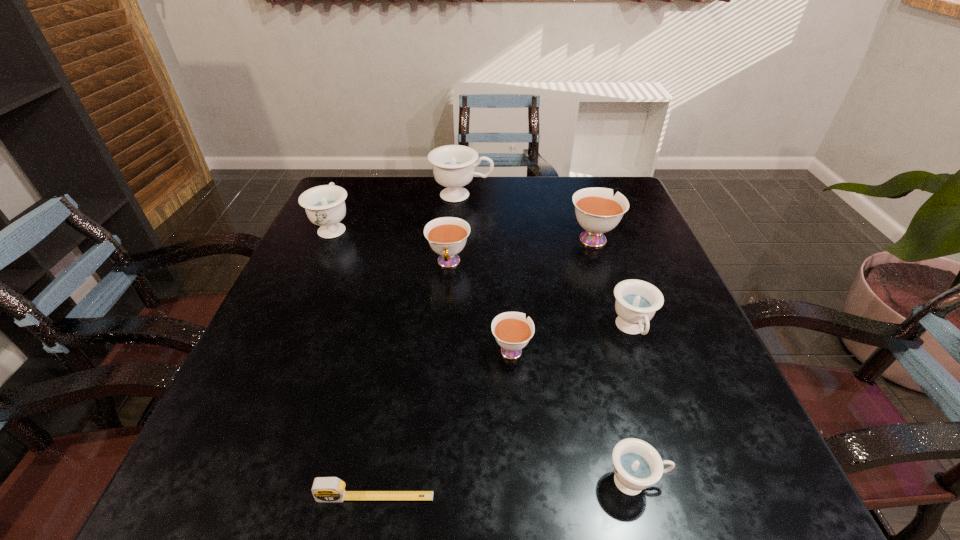
Identify the location of the nearest teacup. The width and height of the screenshot is (960, 540). (637, 465).

This screenshot has height=540, width=960. What are the coordinates of `tape measure` in the screenshot? It's located at (325, 489).

Where is `free spot located on the side of the farthest teacup with the handle`? The image size is (960, 540). free spot located on the side of the farthest teacup with the handle is located at coordinates (615, 195).

The width and height of the screenshot is (960, 540). Identify the location of vacant space positioned 0.070m on the side of the biggest white teacup with the handle. (582, 207).

The height and width of the screenshot is (540, 960). Find the location of `free space located on the side of the biggest white teacup with the handle`. free space located on the side of the biggest white teacup with the handle is located at coordinates (582, 207).

Image resolution: width=960 pixels, height=540 pixels. What are the coordinates of `vacant area located on the side of the biggest white teacup with the handle` in the screenshot? It's located at (576, 187).

The width and height of the screenshot is (960, 540). Find the location of `vacant area situated on the side of the leftmost white teacup with the handle`. vacant area situated on the side of the leftmost white teacup with the handle is located at coordinates (440, 366).

Where is `vacant space located 0.070m on the side of the third farthest blue teacup with the handle`? vacant space located 0.070m on the side of the third farthest blue teacup with the handle is located at coordinates (650, 384).

Locate an element on the screen. This screenshot has height=540, width=960. vacant space located 0.270m on the side of the smallest white teacup with the handle is located at coordinates (504, 249).

The width and height of the screenshot is (960, 540). I want to click on vacant region located on the side of the smallest white teacup with the handle, so click(x=503, y=232).